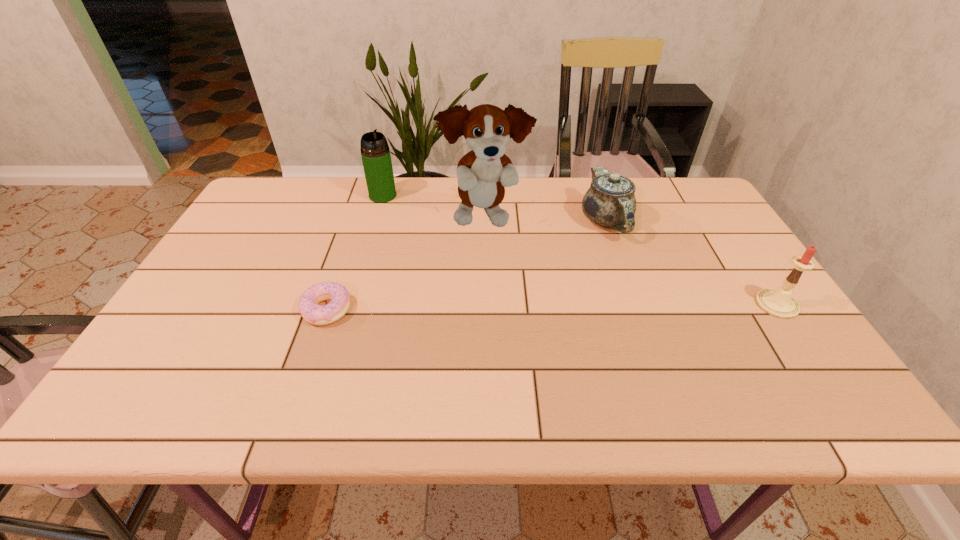
You are a GUI agent. You are given a task and a screenshot of the screen. Output one action in this format:
    pyautogui.click(x=<x>, y=<y>)
    Task: Click on the second closest object to the second tallest object
    This screenshot has height=540, width=960.
    Given the screenshot: What is the action you would take?
    pos(313,313)

Find the location of `free region that satisfies the following two spatial constraints: 1. on the back side of the thermos bottle; 2. on the left side of the doughnut`. free region that satisfies the following two spatial constraints: 1. on the back side of the thermos bottle; 2. on the left side of the doughnut is located at coordinates (366, 195).

At what (x,y) coordinates should I click in order to perform the action: click on vacant space that satisfies the following two spatial constraints: 1. on the front side of the thermos bottle; 2. on the right side of the puppy. Please return your answer as a coordinate pair (x, y). Looking at the image, I should click on (376, 218).

Locate an element on the screen. The width and height of the screenshot is (960, 540). vacant space that satisfies the following two spatial constraints: 1. on the front side of the tallest object; 2. on the right side of the second object from right to left is located at coordinates (485, 221).

Identify the location of free location that satisfies the following two spatial constraints: 1. on the back side of the doughnut; 2. on the right side of the candle. (328, 305).